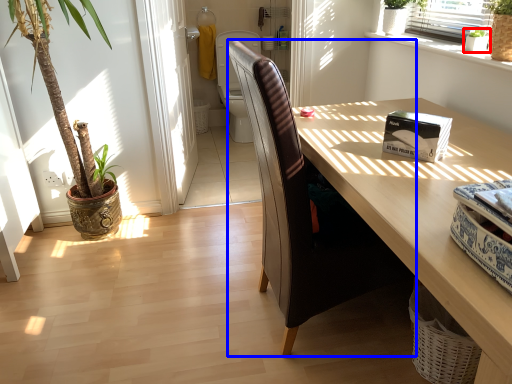
Question: Which object is closer to the camera taking this photo, houseplant (highlighted by a red box) or chair (highlighted by a blue box)?

Choices:
 (A) houseplant
 (B) chair

Answer: (B)